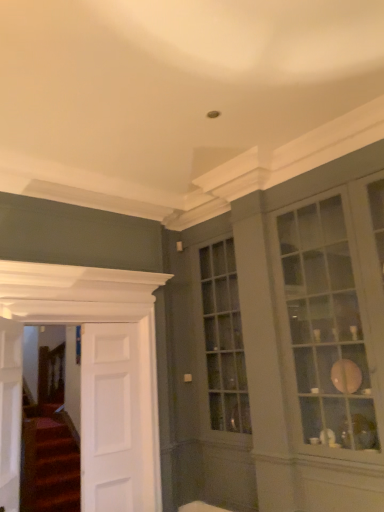
Question: Does white wooden door at left, placed as the first door when sorted from left to right, appear on the left side of matte glass cabinet at right?

Choices:
 (A) no
 (B) yes

Answer: (B)

Question: Could you tell me if white wooden door at left, marked as the 3th door in a right-to-left arrangement, is facing matte glass cabinet at right?

Choices:
 (A) yes
 (B) no

Answer: (A)

Question: Is white wooden door at left, placed as the first door when sorted from left to right, smaller than matte glass cabinet at right?

Choices:
 (A) yes
 (B) no

Answer: (A)

Question: Does white wooden door at left, marked as the 3th door in a right-to-left arrangement, have a lesser width compared to matte glass cabinet at right?

Choices:
 (A) no
 (B) yes

Answer: (B)

Question: Can you confirm if white wooden door at left, marked as the 3th door in a right-to-left arrangement, is shorter than matte glass cabinet at right?

Choices:
 (A) no
 (B) yes

Answer: (B)

Question: Considering the positions of matte glass cabinet at right and white wooden door at left, marked as the 3th door in a right-to-left arrangement, in the image, is matte glass cabinet at right wider or thinner than white wooden door at left, marked as the 3th door in a right-to-left arrangement,?

Choices:
 (A) thin
 (B) wide

Answer: (B)

Question: Choose the correct answer: Is matte glass cabinet at right inside white wooden door at left, marked as the 3th door in a right-to-left arrangement, or outside it?

Choices:
 (A) outside
 (B) inside

Answer: (A)

Question: Based on their positions, is matte glass cabinet at right located to the left or right of white wooden door at left, marked as the 3th door in a right-to-left arrangement?

Choices:
 (A) left
 (B) right

Answer: (B)

Question: Is point (291, 335) positioned closer to the camera than point (4, 335)?

Choices:
 (A) farther
 (B) closer

Answer: (A)

Question: Visually, is white wooden door at left, which is counted as the second door, starting from the left, positioned to the left or to the right of matte glass cabinet at right?

Choices:
 (A) right
 (B) left

Answer: (B)

Question: Would you say white wooden door at left, placed as the second door when sorted from right to left, is inside or outside matte glass cabinet at right?

Choices:
 (A) inside
 (B) outside

Answer: (B)

Question: Considering the positions of white wooden door at left, which is counted as the second door, starting from the left, and matte glass cabinet at right in the image, is white wooden door at left, which is counted as the second door, starting from the left, taller or shorter than matte glass cabinet at right?

Choices:
 (A) tall
 (B) short

Answer: (B)

Question: Is white wooden door at left, which is counted as the second door, starting from the left, bigger or smaller than matte glass cabinet at right?

Choices:
 (A) big
 (B) small

Answer: (B)

Question: Is white wooden door at left, placed as the second door when sorted from right to left, taller or shorter than white smooth door at left, acting as the third door starting from the left?

Choices:
 (A) short
 (B) tall

Answer: (B)

Question: Is point (104, 278) positioned closer to the camera than point (104, 444)?

Choices:
 (A) farther
 (B) closer

Answer: (A)